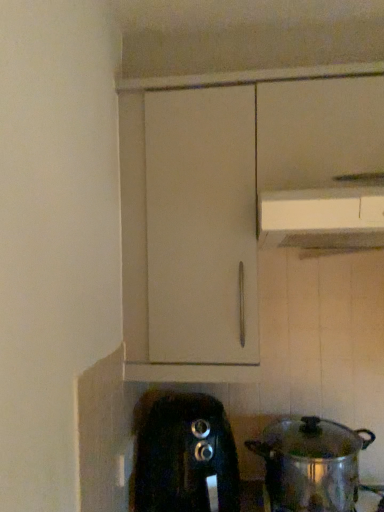
The image size is (384, 512). Describe the element at coordinates (311, 464) in the screenshot. I see `shiny metallic pot at lower right` at that location.

What is the approximate width of shiny metallic pot at lower right?

shiny metallic pot at lower right is 32.53 centimeters wide.

Locate an element on the screen. This screenshot has height=512, width=384. black plastic toaster at lower center is located at coordinates (186, 457).

Is shiny metallic pot at lower right placed right next to white plastic vent at upper center?

No, shiny metallic pot at lower right is not with white plastic vent at upper center.

What's the angular difference between shiny metallic pot at lower right and white plastic vent at upper center's facing directions?

0.489 degrees.

From a real-world perspective, which object stands above the other?

In real-world perspective, white plastic vent at upper center is above.

Considering the relative positions of shiny metallic pot at lower right and white plastic vent at upper center in the image provided, is shiny metallic pot at lower right to the right of white plastic vent at upper center from the viewer's perspective?

No.

Which is in front, shiny metallic pot at lower right or black plastic toaster at lower center?

shiny metallic pot at lower right is in front.

From a real-world perspective, between shiny metallic pot at lower right and black plastic toaster at lower center, who is vertically higher?

From a 3D spatial view, shiny metallic pot at lower right is above.

Can we say shiny metallic pot at lower right lies outside black plastic toaster at lower center?

That's correct, shiny metallic pot at lower right is outside of black plastic toaster at lower center.

From a real-world perspective, does white plastic vent at upper center sit lower than black plastic toaster at lower center?

No, from a real-world perspective, white plastic vent at upper center is not beneath black plastic toaster at lower center.

Which is behind, white plastic vent at upper center or black plastic toaster at lower center?

black plastic toaster at lower center is behind.

Is white plastic vent at upper center oriented towards black plastic toaster at lower center?

No, white plastic vent at upper center is not aimed at black plastic toaster at lower center.

From the picture: Considering the sizes of objects white plastic vent at upper center and black plastic toaster at lower center in the image provided, who is bigger, white plastic vent at upper center or black plastic toaster at lower center?

black plastic toaster at lower center is bigger.

Is black plastic toaster at lower center in contact with shiny metallic pot at lower right?

No, black plastic toaster at lower center is not making contact with shiny metallic pot at lower right.

The image size is (384, 512). What are the coordinates of `kitchen appliance in front of the black plastic toaster at lower center` in the screenshot? It's located at (311, 464).

Is shiny metallic pot at lower right at the back of black plastic toaster at lower center?

black plastic toaster at lower center is not turned away from shiny metallic pot at lower right.

Can you tell me how much black plastic toaster at lower center and shiny metallic pot at lower right differ in facing direction?

There is a 1.07-degree angle between the facing directions of black plastic toaster at lower center and shiny metallic pot at lower right.

Is the position of black plastic toaster at lower center more distant than that of white plastic vent at upper center?

Yes, it is behind white plastic vent at upper center.

Is black plastic toaster at lower center to the left or to the right of white plastic vent at upper center in the image?

black plastic toaster at lower center is positioned on white plastic vent at upper center's left side.

How far apart are black plastic toaster at lower center and white plastic vent at upper center?

They are 25.34 inches apart.

Which is more distant, (190,400) or (371,234)?

The point (190,400) is farther.

Where is `kitchen appliance that appears behind the white plastic vent at upper center`? The width and height of the screenshot is (384, 512). kitchen appliance that appears behind the white plastic vent at upper center is located at coordinates (311, 464).

From the picture: Is white plastic vent at upper center taller or shorter than shiny metallic pot at lower right?

Considering their sizes, white plastic vent at upper center has less height than shiny metallic pot at lower right.

What's the angular difference between white plastic vent at upper center and shiny metallic pot at lower right's facing directions?

The facing directions of white plastic vent at upper center and shiny metallic pot at lower right are 0.489 degrees apart.

Is white plastic vent at upper center located outside shiny metallic pot at lower right?

That's correct, white plastic vent at upper center is outside of shiny metallic pot at lower right.

This screenshot has height=512, width=384. I want to click on vent in front of the shiny metallic pot at lower right, so 323,218.

Where is `home appliance lying behind the shiny metallic pot at lower right`? home appliance lying behind the shiny metallic pot at lower right is located at coordinates (186, 457).

Looking at the image, which one is located further to black plastic toaster at lower center, white plastic vent at upper center or shiny metallic pot at lower right?

white plastic vent at upper center is further to black plastic toaster at lower center.

From the image, which object appears to be nearer to shiny metallic pot at lower right, white plastic vent at upper center or black plastic toaster at lower center?

black plastic toaster at lower center is closer to shiny metallic pot at lower right.

Looking at the image, which one is located closer to white plastic vent at upper center, shiny metallic pot at lower right or black plastic toaster at lower center?

The object closer to white plastic vent at upper center is black plastic toaster at lower center.

In the scene shown: Which object lies further to the anchor point black plastic toaster at lower center, shiny metallic pot at lower right or white plastic vent at upper center?

Based on the image, white plastic vent at upper center appears to be further to black plastic toaster at lower center.

From the image, which object appears to be farther from shiny metallic pot at lower right, black plastic toaster at lower center or white plastic vent at upper center?

white plastic vent at upper center is further to shiny metallic pot at lower right.

Based on their spatial positions, is black plastic toaster at lower center or shiny metallic pot at lower right closer to white plastic vent at upper center?

black plastic toaster at lower center lies closer to white plastic vent at upper center than the other object.

This screenshot has height=512, width=384. I want to click on kitchen appliance that lies between white plastic vent at upper center and black plastic toaster at lower center from top to bottom, so click(311, 464).